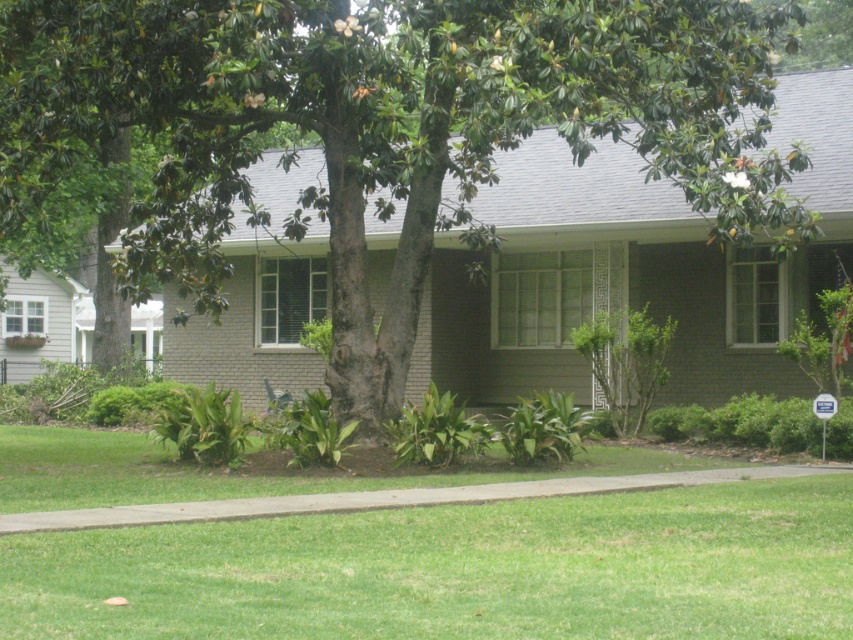
What are the coordinates of `green leafy tree at center` in the screenshot? It's located at (383, 128).

Which is below, green leafy tree at center or green grass at lower center?

Positioned lower is green grass at lower center.

Is point (492, 77) positioned in front of point (306, 614)?

No.

Image resolution: width=853 pixels, height=640 pixels. Identify the location of green leafy tree at center. (383, 128).